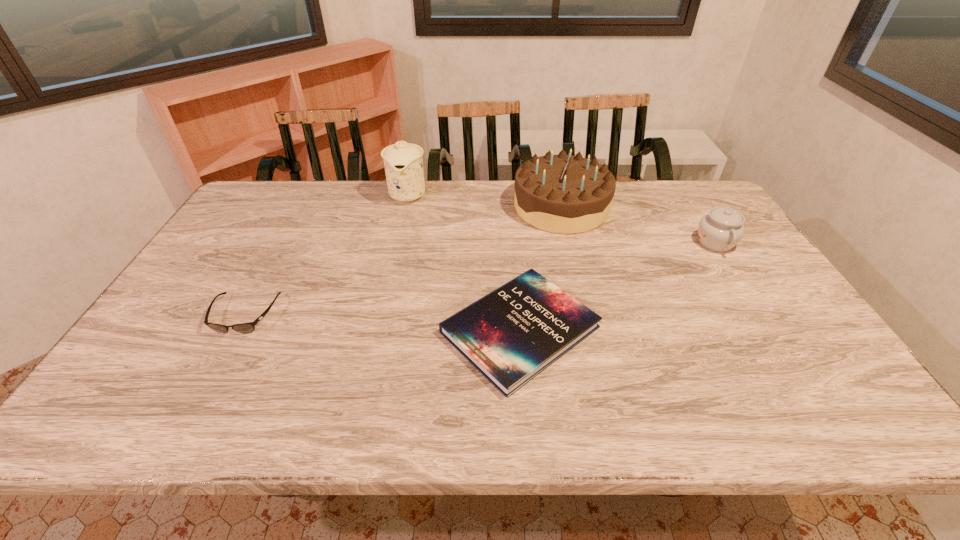
Where is `free space that satisfies the following two spatial constraints: 1. on the spout of the taller chinaware; 2. on the left side of the shortest object`? The image size is (960, 540). free space that satisfies the following two spatial constraints: 1. on the spout of the taller chinaware; 2. on the left side of the shortest object is located at coordinates coord(377,329).

Find the location of a particular element. The width and height of the screenshot is (960, 540). free space that satisfies the following two spatial constraints: 1. on the front-facing side of the birthday cake; 2. on the front-facing side of the leftmost object is located at coordinates tap(588, 315).

What are the coordinates of `blank space that satisfies the following two spatial constraints: 1. on the spout of the shorter chinaware; 2. on the left side of the fourth object from right to left` in the screenshot? It's located at (397, 242).